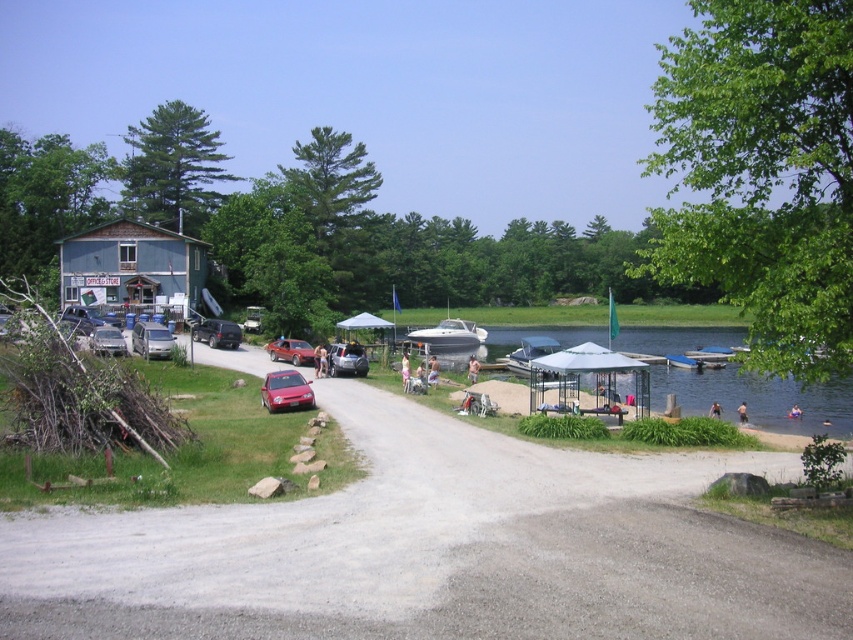
You are planning to transport both the white matte boat at center and the shiny red car at center using a flatbed truck. Which object requires a larger flatbed truck to accommodate its size?

The white matte boat at center requires a larger flatbed truck since it has a larger size compared to the shiny red car at center.

Looking at this image, you are standing at the lakeside and see the white matte boat at center and the shiny red car at center. Which object is closer to the water?

The white matte boat at center is closer to the water because it is positioned under the shiny red car at center, indicating it is lower in elevation and nearer to the water level.